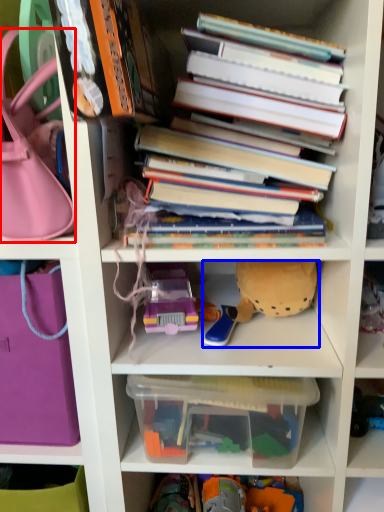
Question: Which object appears farthest to the camera in this image, handbag (highlighted by a red box) or toy (highlighted by a blue box)?

Choices:
 (A) handbag
 (B) toy

Answer: (B)